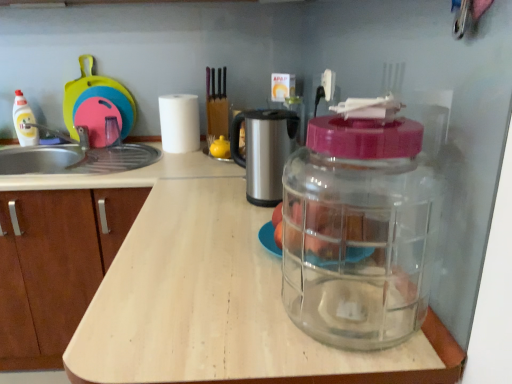
Question: Is white matte paper towel at center wider or thinner than translucent glass apples at center?

Choices:
 (A) wide
 (B) thin

Answer: (B)

Question: From a real-world perspective, is white matte paper towel at center physically located above or below translucent glass apples at center?

Choices:
 (A) above
 (B) below

Answer: (A)

Question: Which object is the farthest from the white matte paper towel at center?

Choices:
 (A) rubberized plastic cutting board at upper left
 (B) transparent plastic container at center, which is the second bottle in top-to-bottom order
 (C) transparent wood countertop at center
 (D) stainless steel coffee maker at center
 (E) translucent glass apples at center

Answer: (B)

Question: Which of these objects is positioned closest to the white matte paper towel at center?

Choices:
 (A) transparent wood countertop at center
 (B) rubberized plastic cutting board at upper left
 (C) translucent glass apples at center
 (D) transparent plastic container at center, which is the second bottle in top-to-bottom order
 (E) stainless steel coffee maker at center

Answer: (B)